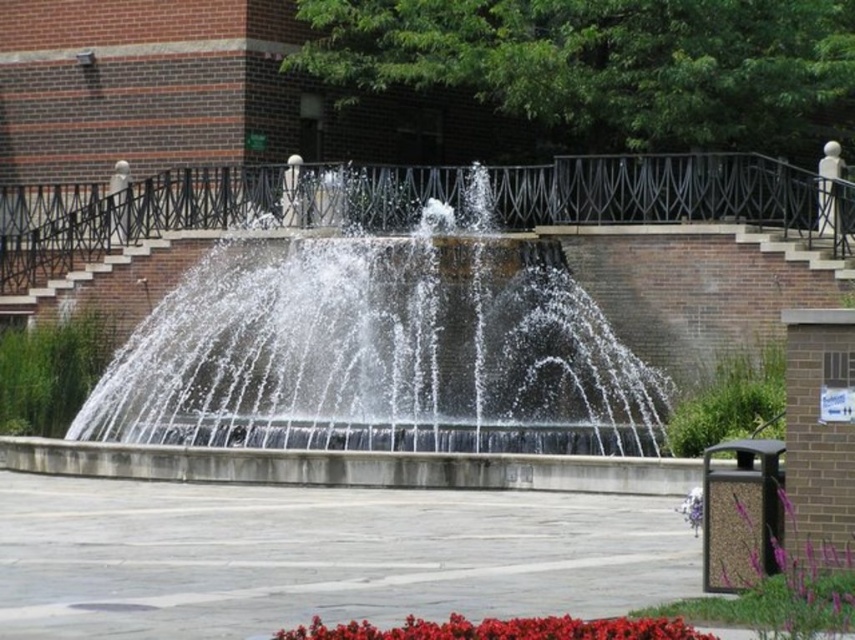
You are standing at the edge of the plaza and want to take a photo of the purple matte flower at lower right without the clear concrete fountain at center blocking the view. Is this possible given their positions?

The purple matte flower at lower right is behind the clear concrete fountain at center, so it would be blocked from view. To capture the flower without the fountain obstructing it, you would need to position yourself in a way that allows you to see around or over the fountain, but based on their described positions, this might not be feasible without moving closer or changing your angle significantly.